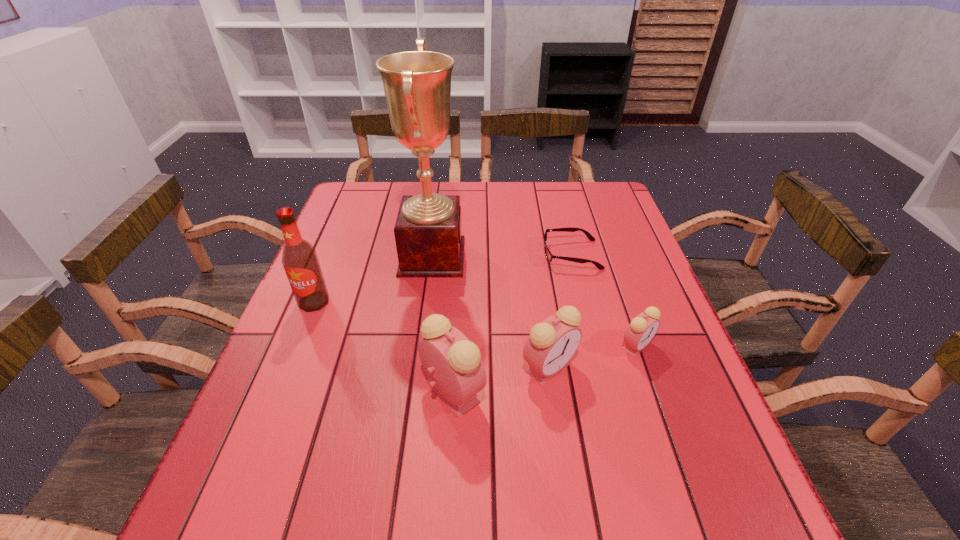
Find the location of a particular element. free point that keeps the alarm clocks evenly spaced on the left is located at coordinates (347, 417).